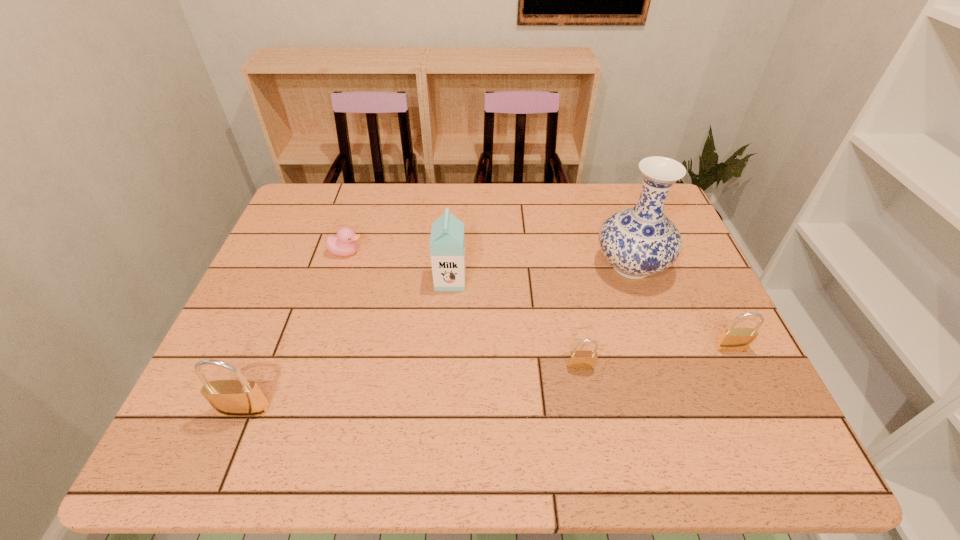
If we want them evenly spaced by inserting an extra padlock among them, please locate a free spot for this new padlock. Please provide its 2D coordinates. Your answer should be formatted as a tuple, i.e. [(x, y)], where the tuple contains the x and y coordinates of a point satisfying the conditions above.

[(419, 387)]